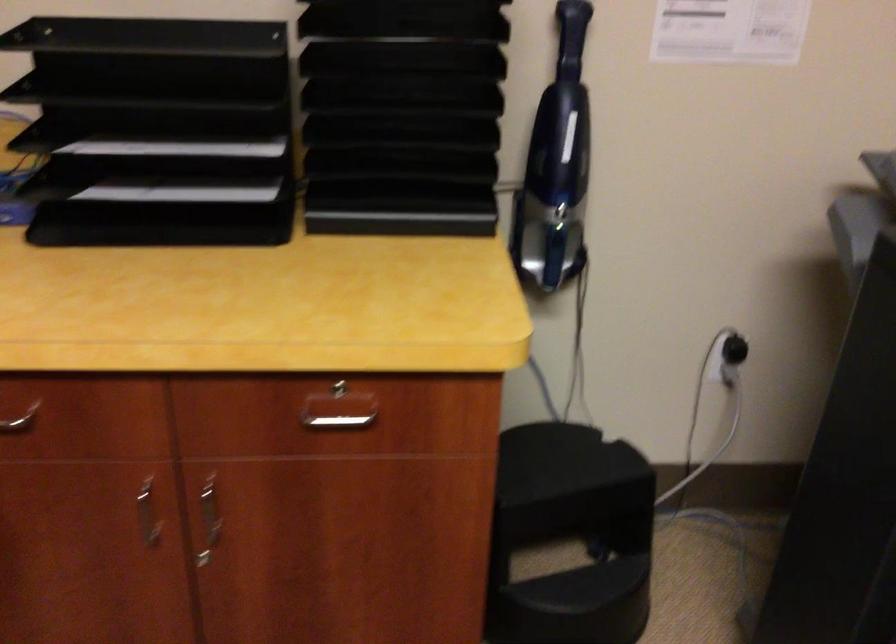
Where would you pull the silver drawer handle? Please return your answer as a coordinate pair (x, y).

(209, 520)